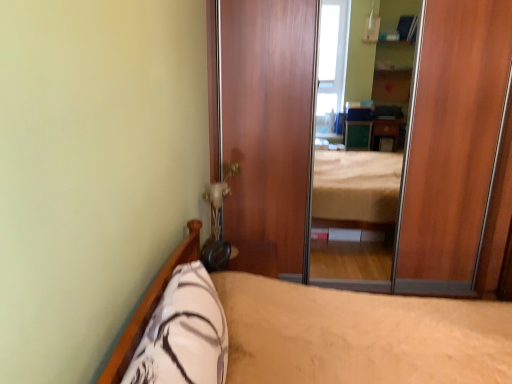
Question: Considering the relative positions of wooden screen door at center and beige fabric bed at lower left in the image provided, is wooden screen door at center to the left or to the right of beige fabric bed at lower left?

Choices:
 (A) left
 (B) right

Answer: (B)

Question: From a real-world perspective, is wooden screen door at center positioned above or below beige fabric bed at lower left?

Choices:
 (A) above
 (B) below

Answer: (A)

Question: Which is nearer to the beige fabric bed at lower left?

Choices:
 (A) wooden screen door at center
 (B) white soft pillow at lower left

Answer: (B)

Question: Which object is positioned farthest from the beige fabric bed at lower left?

Choices:
 (A) wooden screen door at center
 (B) white soft pillow at lower left

Answer: (A)